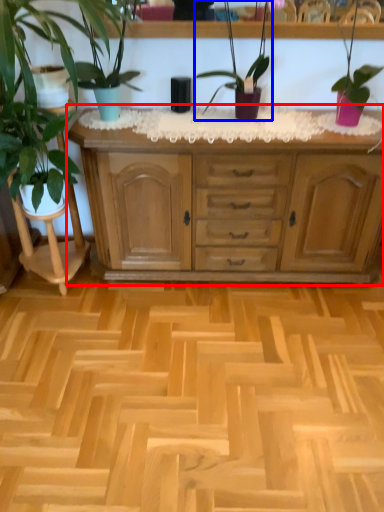
Question: Which object appears farthest to the camera in this image, chest of drawers (highlighted by a red box) or houseplant (highlighted by a blue box)?

Choices:
 (A) chest of drawers
 (B) houseplant

Answer: (A)